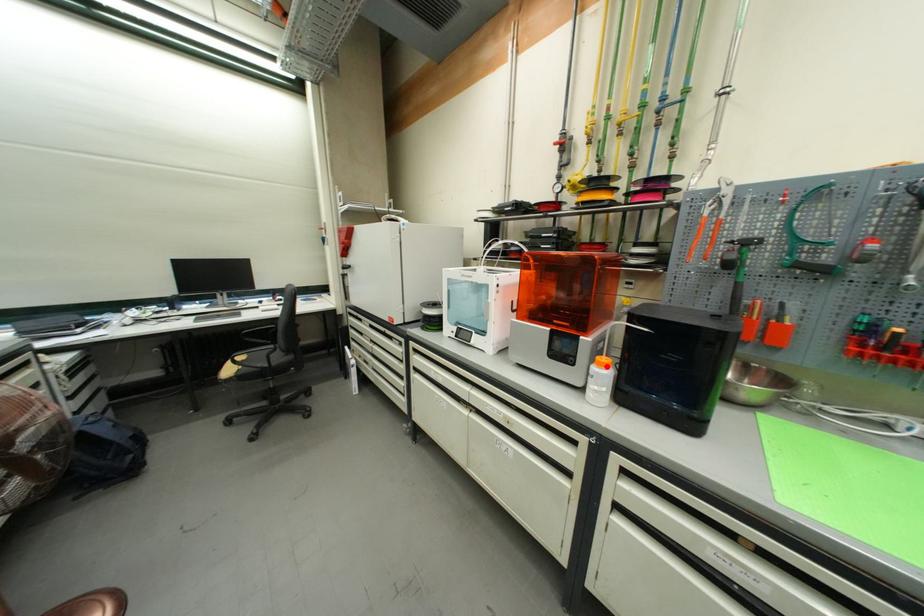
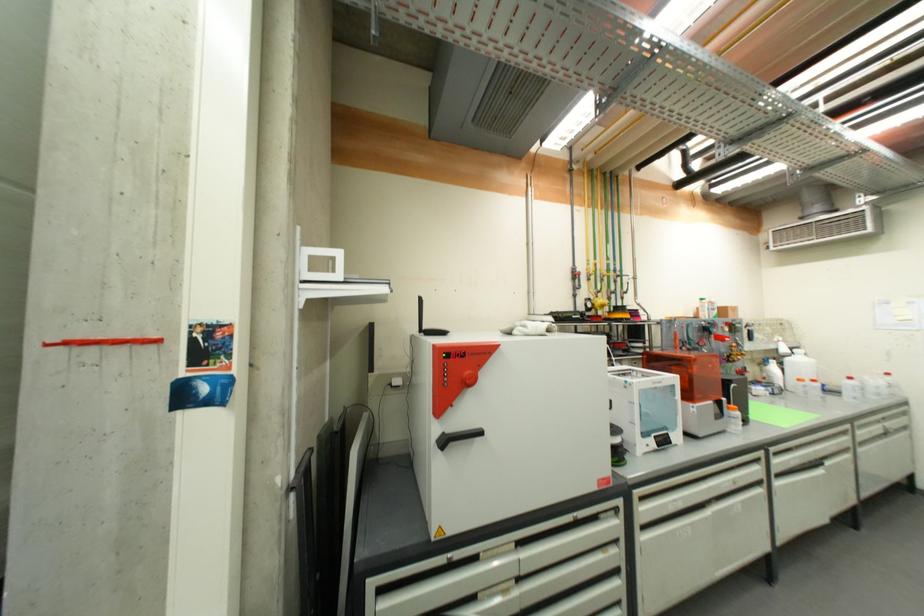
Where in the second image is the point corresponding to the highlighted location from the first image?

(739, 411)